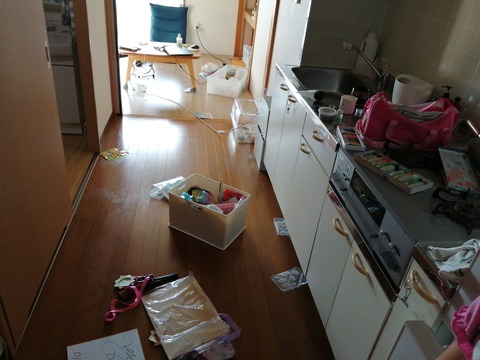
I want to click on electric outlet, so click(200, 28).